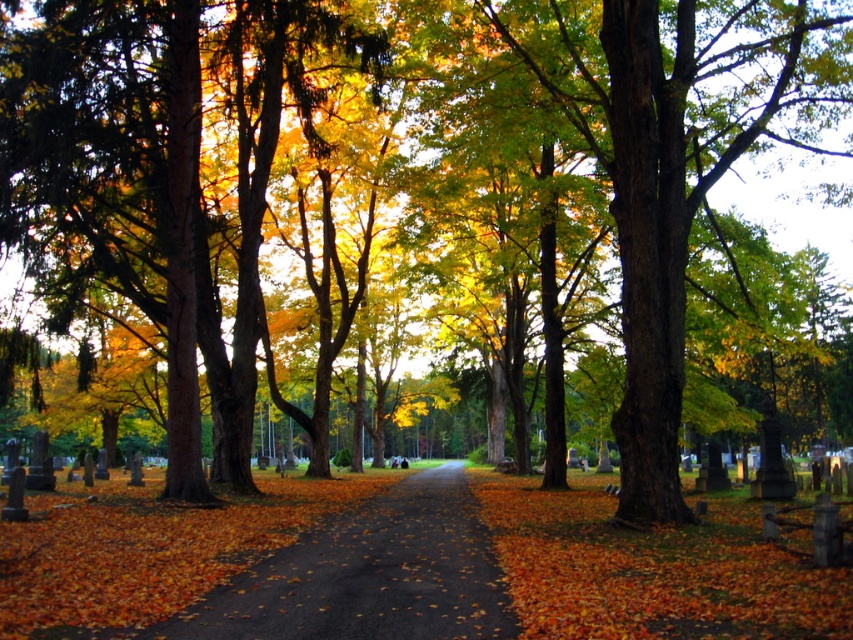
You are a gardener trying to clear the golden yellow leaves at left from the brown asphalt path at center. Can you tell me which one is bigger in size?

The golden yellow leaves at left are larger in size compared to the brown asphalt path at center.

From the picture: You are a gardener trying to clean up the golden yellow leaves at left and the brown asphalt path at center. Which object is higher in elevation?

The golden yellow leaves at left are located above the brown asphalt path at center, so they are higher in elevation.